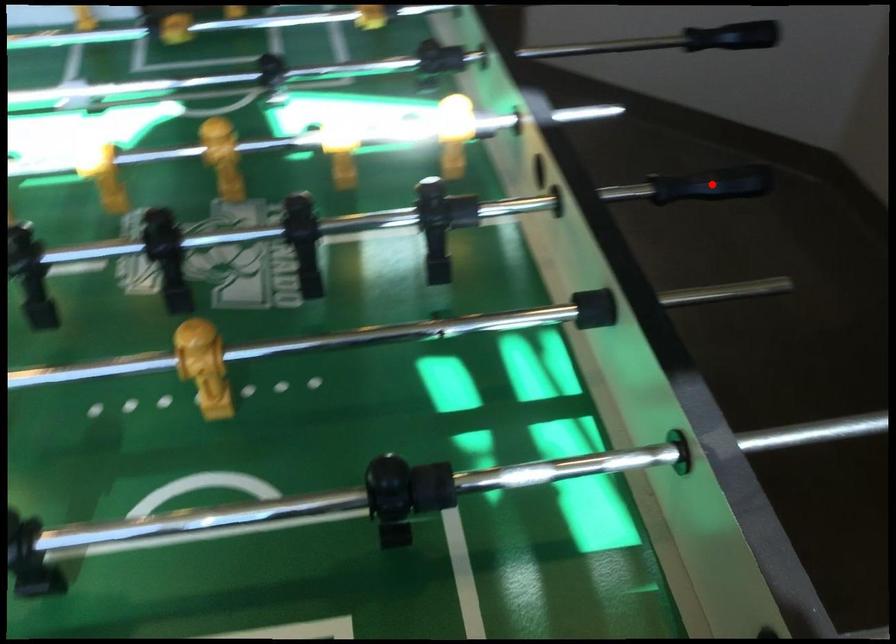
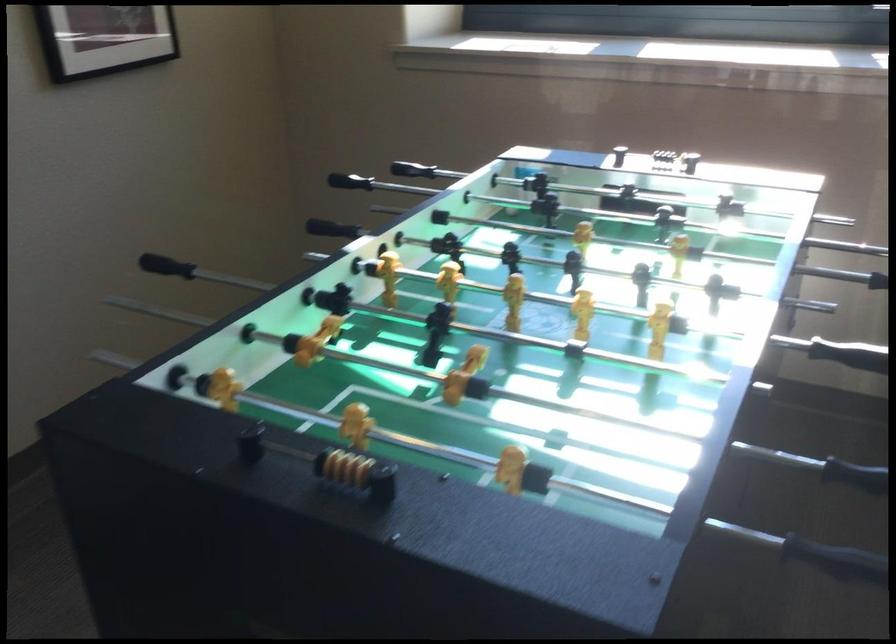
Question: I am providing you with two images of the same scene from different viewpoints. In image1, a red point is highlighted. Considering the same 3D point in image2, which of the following is correct?

Choices:
 (A) It is closer
 (B) It is farther

Answer: (B)